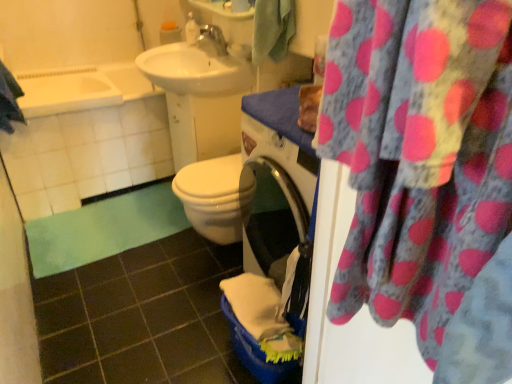
Locate an element on the screen. The width and height of the screenshot is (512, 384). white glossy soap dispenser at upper center is located at coordinates (191, 30).

In order to face white glossy soap dispenser at upper center, should I rotate leftwards or rightwards?

You should rotate left by 8.135 degrees.

What is the approximate width of white glossy bathtub at upper left?

white glossy bathtub at upper left is 27.56 inches in width.

What do you see at coordinates (197, 67) in the screenshot? Image resolution: width=512 pixels, height=384 pixels. I see `white glossy sink at upper center` at bounding box center [197, 67].

The image size is (512, 384). I want to click on silver metallic faucet at upper center, so click(x=212, y=40).

What do you see at coordinates (419, 154) in the screenshot? I see `pink polka dot fabric at upper right` at bounding box center [419, 154].

This screenshot has width=512, height=384. I want to click on blue textured towel at upper left, the 1th beach towel viewed from the left, so click(9, 100).

From the image's perspective, which object appears higher, white glossy soap dispenser at upper center or white glossy bathtub at upper left?

white glossy soap dispenser at upper center.

From their relative heights in the image, would you say white glossy soap dispenser at upper center is taller or shorter than white glossy bathtub at upper left?

Clearly, white glossy soap dispenser at upper center is taller compared to white glossy bathtub at upper left.

Could you tell me if white glossy soap dispenser at upper center is facing white glossy bathtub at upper left?

No, white glossy soap dispenser at upper center is not aimed at white glossy bathtub at upper left.

Is white glossy soap dispenser at upper center in front of white glossy bathtub at upper left?

No, the depth of white glossy soap dispenser at upper center is greater than that of white glossy bathtub at upper left.

From the picture: Is pink polka dot fabric at upper right bigger than white glossy soap dispenser at upper center?

Yes.

Which point is more distant from viewer, (x=320, y=151) or (x=190, y=32)?

The point (x=190, y=32) is more distant.

What are the coordinates of `toiletry behind the pink polka dot fabric at upper right` in the screenshot? It's located at (191, 30).

From a real-world perspective, which object rests below the other?

pink polka dot fabric at upper right.

Locate an element on the screen. toiletry located above the green soft mat at lower left (from a real-world perspective) is located at coordinates (191, 30).

Is white glossy soap dispenser at upper center inside the boundaries of green soft mat at lower left, or outside?

white glossy soap dispenser at upper center lies outside green soft mat at lower left.

From a real-world perspective, relative to green soft mat at lower left, is white glossy soap dispenser at upper center vertically above or below?

Clearly, from a real-world perspective, white glossy soap dispenser at upper center is above green soft mat at lower left.

How different are the orientations of white glossy soap dispenser at upper center and green soft mat at lower left in degrees?

Result: The angle between the facing direction of white glossy soap dispenser at upper center and the facing direction of green soft mat at lower left is 90 degrees.

Is white glossy soap dispenser at upper center completely or partially outside of silver metallic faucet at upper center?

white glossy soap dispenser at upper center lies outside silver metallic faucet at upper center's area.

From the image's perspective, between white glossy soap dispenser at upper center and silver metallic faucet at upper center, who is located below?

silver metallic faucet at upper center is shown below in the image.

Who is taller, white glossy soap dispenser at upper center or silver metallic faucet at upper center?

Standing taller between the two is white glossy soap dispenser at upper center.

Which is correct: green fabric towel at upper center, which ranks as the 2th beach towel in left-to-right order, is inside white glossy bathtub at upper left, or outside of it?

green fabric towel at upper center, which ranks as the 2th beach towel in left-to-right order, lies outside white glossy bathtub at upper left.

In the scene shown: Which is behind, green fabric towel at upper center, marked as the 1th beach towel in a right-to-left arrangement, or white glossy bathtub at upper left?

white glossy bathtub at upper left.

Is green fabric towel at upper center, marked as the 1th beach towel in a right-to-left arrangement, with white glossy bathtub at upper left?

No, green fabric towel at upper center, marked as the 1th beach towel in a right-to-left arrangement, is not making contact with white glossy bathtub at upper left.

From the image's perspective, which one is positioned higher, green fabric towel at upper center, marked as the 1th beach towel in a right-to-left arrangement, or white glossy bathtub at upper left?

green fabric towel at upper center, marked as the 1th beach towel in a right-to-left arrangement.

From a real-world perspective, is green soft mat at lower left on green fabric towel at upper center, marked as the 1th beach towel in a right-to-left arrangement?

No, from a real-world perspective, green soft mat at lower left is not on top of green fabric towel at upper center, marked as the 1th beach towel in a right-to-left arrangement.

Considering the relative sizes of green soft mat at lower left and green fabric towel at upper center, which ranks as the 2th beach towel in left-to-right order, in the image provided, is green soft mat at lower left smaller than green fabric towel at upper center, which ranks as the 2th beach towel in left-to-right order,?

No, green soft mat at lower left is not smaller than green fabric towel at upper center, which ranks as the 2th beach towel in left-to-right order.

Could you tell me if green soft mat at lower left is turned towards green fabric towel at upper center, marked as the 1th beach towel in a right-to-left arrangement?

No, green soft mat at lower left does not turn towards green fabric towel at upper center, marked as the 1th beach towel in a right-to-left arrangement.

Find the location of `bath mat on the left of green fabric towel at upper center, marked as the 1th beach towel in a right-to-left arrangement`. bath mat on the left of green fabric towel at upper center, marked as the 1th beach towel in a right-to-left arrangement is located at coordinates (103, 229).

Is green soft mat at lower left facing towards pink polka dot fabric at upper right?

No.

You are a GUI agent. You are given a task and a screenshot of the screen. Output one action in this format:
    pyautogui.click(x=<x>, y=<y>)
    Task: Click on the curtain in front of the green soft mat at lower left
    This screenshot has width=512, height=384.
    Given the screenshot: What is the action you would take?
    pyautogui.click(x=419, y=154)

Is green soft mat at lower left not close to pink polka dot fabric at upper right?

Yes, green soft mat at lower left and pink polka dot fabric at upper right are quite far apart.

Looking at the image, does green soft mat at lower left seem bigger or smaller compared to pink polka dot fabric at upper right?

In the image, green soft mat at lower left appears to be smaller than pink polka dot fabric at upper right.

At what (x,y) coordinates should I click in order to perform the action: click on toiletry above the white glossy bathtub at upper left (from the image's perspective). Please return your answer as a coordinate pair (x, y). Looking at the image, I should click on (191, 30).

The height and width of the screenshot is (384, 512). I want to click on curtain below the white glossy soap dispenser at upper center (from a real-world perspective), so click(419, 154).

When comparing their distances from silver metallic faucet at upper center, does pink polka dot fabric at upper right or white glossy sink at upper center seem further?

Based on the image, pink polka dot fabric at upper right appears to be further to silver metallic faucet at upper center.

Based on their spatial positions, is green soft mat at lower left or white glossy sink at upper center closer to silver metallic faucet at upper center?

white glossy sink at upper center is positioned closer to the anchor silver metallic faucet at upper center.

From the image, which object appears to be nearer to white glossy soap dispenser at upper center, green fabric towel at upper center, marked as the 1th beach towel in a right-to-left arrangement, or green soft mat at lower left?

Based on the image, green fabric towel at upper center, marked as the 1th beach towel in a right-to-left arrangement, appears to be nearer to white glossy soap dispenser at upper center.

Which object lies further to the anchor point white glossy bathtub at upper left, silver metallic faucet at upper center or green soft mat at lower left?

Based on the image, silver metallic faucet at upper center appears to be further to white glossy bathtub at upper left.

From the image, which object appears to be nearer to white glossy bathtub at upper left, white glossy sink at upper center or blue textured towel at upper left, the 1th beach towel viewed from the left?

blue textured towel at upper left, the 1th beach towel viewed from the left, is positioned closer to the anchor white glossy bathtub at upper left.

Which object lies nearer to the anchor point green soft mat at lower left, white glossy sink at upper center or pink polka dot fabric at upper right?

white glossy sink at upper center lies closer to green soft mat at lower left than the other object.

Looking at the image, which one is located closer to blue textured towel at upper left, positioned as the second beach towel in right-to-left order, silver metallic faucet at upper center or pink polka dot fabric at upper right?

silver metallic faucet at upper center is closer to blue textured towel at upper left, positioned as the second beach towel in right-to-left order.

From the image, which object appears to be nearer to blue textured towel at upper left, positioned as the second beach towel in right-to-left order, pink polka dot fabric at upper right or silver metallic faucet at upper center?

silver metallic faucet at upper center is closer to blue textured towel at upper left, positioned as the second beach towel in right-to-left order.

You are a GUI agent. You are given a task and a screenshot of the screen. Output one action in this format:
    pyautogui.click(x=<x>, y=<y>)
    Task: Click on the tap between white glossy sink at upper center and white glossy soap dispenser at upper center along the z-axis
    The height and width of the screenshot is (384, 512).
    Given the screenshot: What is the action you would take?
    pyautogui.click(x=212, y=40)

Find the location of `sink situated between white glossy bathtub at upper left and silver metallic faucet at upper center from left to right`. sink situated between white glossy bathtub at upper left and silver metallic faucet at upper center from left to right is located at coordinates (197, 67).

You are a GUI agent. You are given a task and a screenshot of the screen. Output one action in this format:
    pyautogui.click(x=<x>, y=<y>)
    Task: Click on the sink between blue textured towel at upper left, positioned as the second beach towel in right-to-left order, and silver metallic faucet at upper center from left to right
    The height and width of the screenshot is (384, 512).
    Given the screenshot: What is the action you would take?
    pyautogui.click(x=197, y=67)

What are the coordinates of `tap located between pink polka dot fabric at upper right and white glossy soap dispenser at upper center in the depth direction` in the screenshot? It's located at coord(212,40).